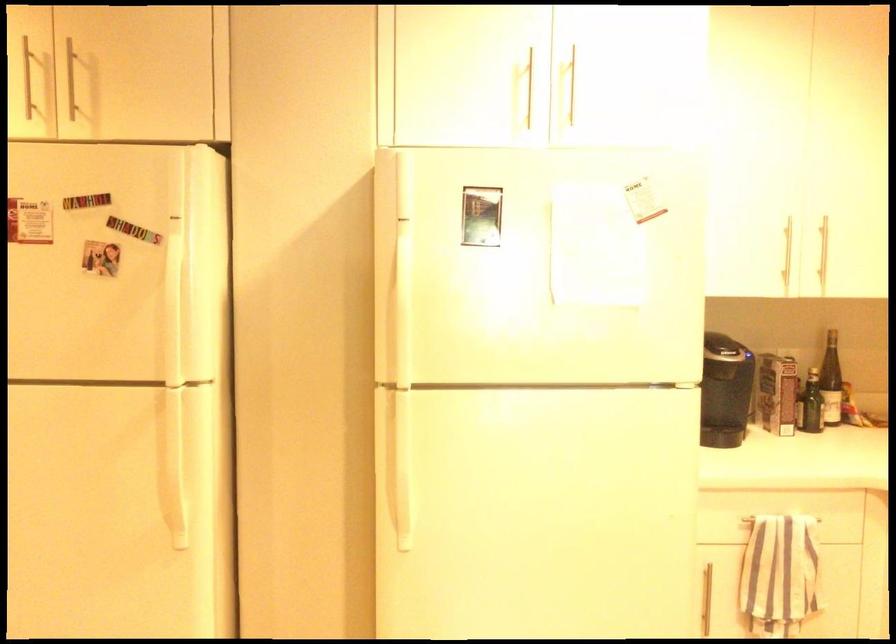
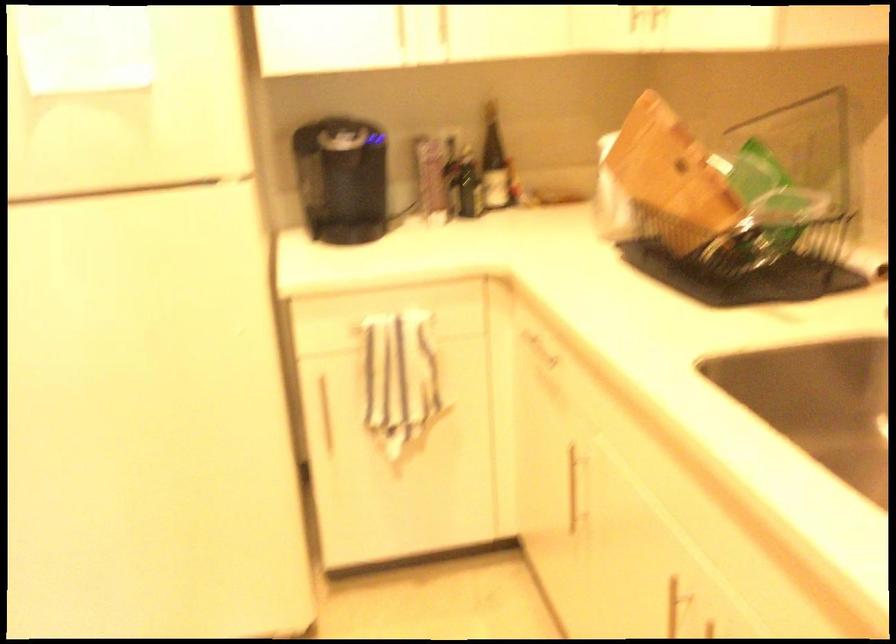
Question: The images are taken continuously from a first-person perspective. In which direction are you moving?

Choices:
 (A) Left
 (B) Right
 (C) Forward
 (D) Backward

Answer: (B)